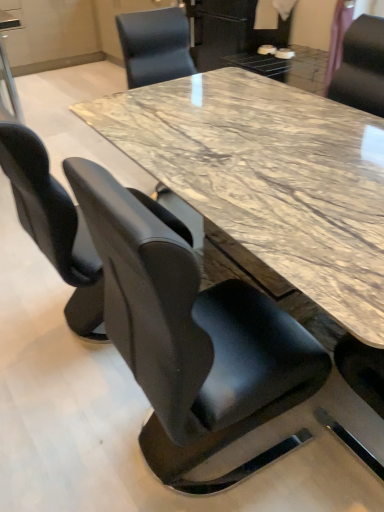
Question: Is there a large distance between black leather chair at upper right, acting as the 1th chair starting from the right, and black leather chair at center, the third chair from the back?

Choices:
 (A) no
 (B) yes

Answer: (B)

Question: Is black leather chair at upper right, which appears as the third chair when viewed from the left, at the left side of black leather chair at center, the 1th chair when ordered from front to back?

Choices:
 (A) no
 (B) yes

Answer: (A)

Question: From the image's perspective, would you say black leather chair at upper right, which appears as the third chair when viewed from the left, is shown under black leather chair at center, the third chair from the back?

Choices:
 (A) yes
 (B) no

Answer: (B)

Question: Is black leather chair at upper right, acting as the 1th chair starting from the right, not within black leather chair at center, which is the 2th chair from right to left?

Choices:
 (A) yes
 (B) no

Answer: (A)

Question: Does black leather chair at upper right, positioned as the 3th chair in front-to-back order, have a lesser height compared to black leather chair at center, the 1th chair when ordered from front to back?

Choices:
 (A) no
 (B) yes

Answer: (B)

Question: Visually, is black leather chair at left, which is the 2th chair in front-to-back order, positioned to the left or to the right of black leather chair at upper right, positioned as the 3th chair in front-to-back order?

Choices:
 (A) right
 (B) left

Answer: (B)

Question: Is black leather chair at left, which is the 2th chair in front-to-back order, wider or thinner than black leather chair at upper right, the first chair when ordered from back to front?

Choices:
 (A) thin
 (B) wide

Answer: (B)

Question: Is black leather chair at left, which is the 2th chair in front-to-back order, bigger or smaller than black leather chair at upper right, the first chair when ordered from back to front?

Choices:
 (A) big
 (B) small

Answer: (A)

Question: Is point (16, 202) positioned closer to the camera than point (379, 64)?

Choices:
 (A) farther
 (B) closer

Answer: (B)

Question: Is point (132, 321) closer or farther from the camera than point (350, 92)?

Choices:
 (A) closer
 (B) farther

Answer: (A)

Question: Is black leather chair at center, the 2th chair from the left, inside the boundaries of black leather chair at upper right, which appears as the third chair when viewed from the left, or outside?

Choices:
 (A) outside
 (B) inside

Answer: (A)

Question: Considering the positions of black leather chair at center, the 2th chair from the left, and black leather chair at upper right, the first chair when ordered from back to front, in the image, is black leather chair at center, the 2th chair from the left, taller or shorter than black leather chair at upper right, the first chair when ordered from back to front,?

Choices:
 (A) short
 (B) tall

Answer: (B)

Question: Is black leather chair at center, the third chair from the back, wider or thinner than black leather chair at upper right, the first chair when ordered from back to front?

Choices:
 (A) thin
 (B) wide

Answer: (B)

Question: Is black leather chair at upper right, the first chair when ordered from back to front, in front of or behind black leather chair at center, the 2th chair from the left, in the image?

Choices:
 (A) front
 (B) behind

Answer: (B)

Question: From the image's perspective, is black leather chair at upper right, the first chair when ordered from back to front, positioned above or below black leather chair at center, the 2th chair from the left?

Choices:
 (A) below
 (B) above

Answer: (B)